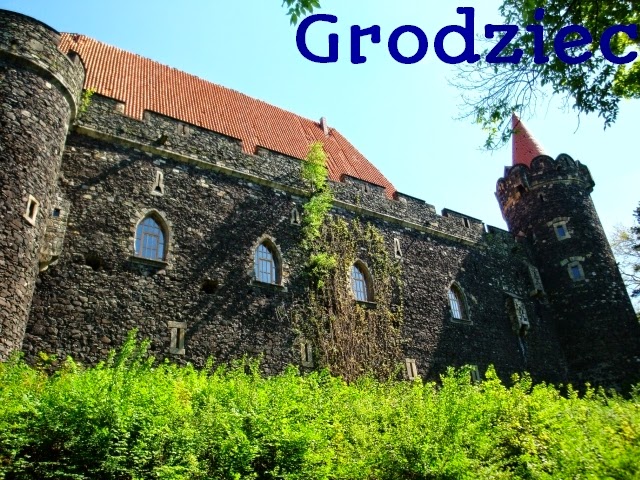
I want to click on windows, so click(148, 238), click(267, 266), click(358, 285), click(457, 303), click(579, 272), click(560, 228).